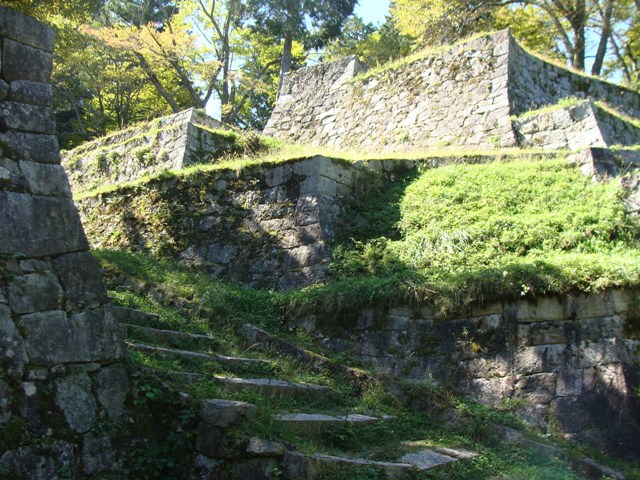
Where is `highest wall to the right`? The height and width of the screenshot is (480, 640). highest wall to the right is located at coordinates (390, 96).